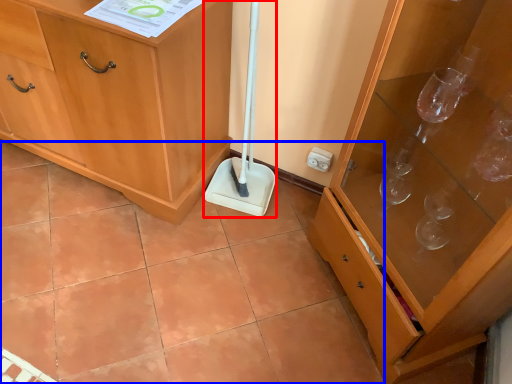
Question: Among these objects, which one is farthest to the camera, shovel (highlighted by a red box) or ceramic tile (highlighted by a blue box)?

Choices:
 (A) shovel
 (B) ceramic tile

Answer: (A)